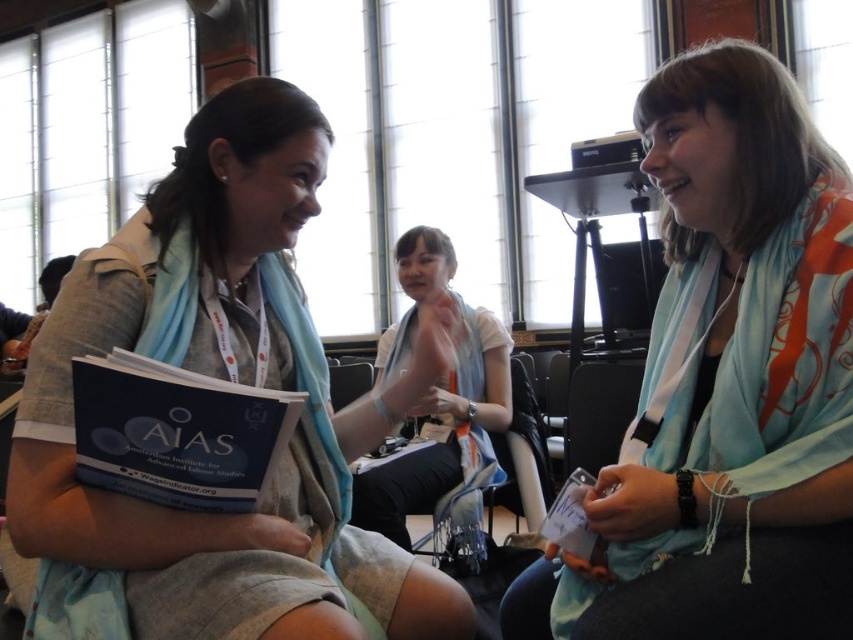
Consider the image. You are a photographer at the conference and want to capture both the matte blue scarf at left and the blue matte book at center in the same frame. What is the minimum distance you need to step back to ensure both objects are fully visible?

The minimum distance you need to step back is 8.61 inches to ensure both the matte blue scarf at left and the blue matte book at center are fully visible since they are 8.61 inches apart from each other.

You are at a conference and see two items at the center of the image. The light blue scarf at center and the blue matte book at center. Which item is positioned to the right?

The light blue scarf at center is to the right of the blue matte book at center.